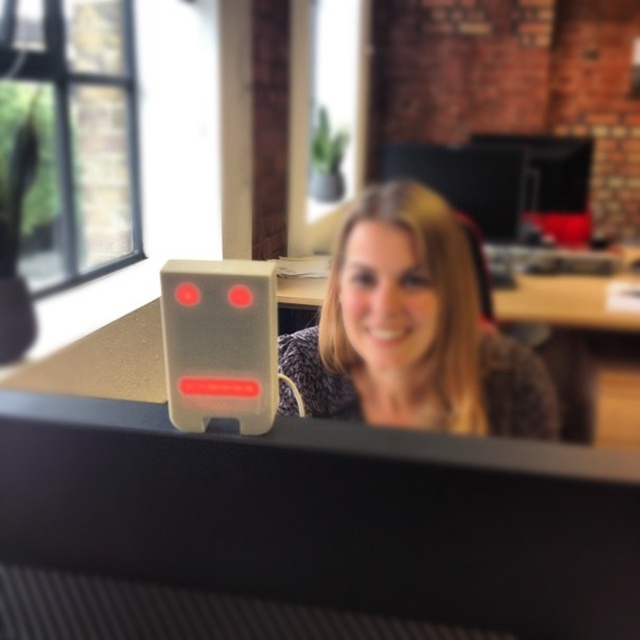
Question: Can you confirm if black plastic computer monitor at center is smaller than speckled fabric shirt at center?

Choices:
 (A) no
 (B) yes

Answer: (B)

Question: Does black plastic computer monitor at center have a larger size compared to speckled fabric shirt at center?

Choices:
 (A) yes
 (B) no

Answer: (B)

Question: From the image, what is the correct spatial relationship of black plastic computer monitor at center in relation to speckled fabric shirt at center?

Choices:
 (A) above
 (B) below

Answer: (B)

Question: Which point is farther from the camera taking this photo?

Choices:
 (A) (508, 468)
 (B) (529, 364)

Answer: (B)

Question: Which of the following is the farthest from the observer?

Choices:
 (A) (356, 284)
 (B) (378, 481)

Answer: (A)

Question: Which point appears closest to the camera in this image?

Choices:
 (A) (118, 406)
 (B) (285, 394)

Answer: (A)